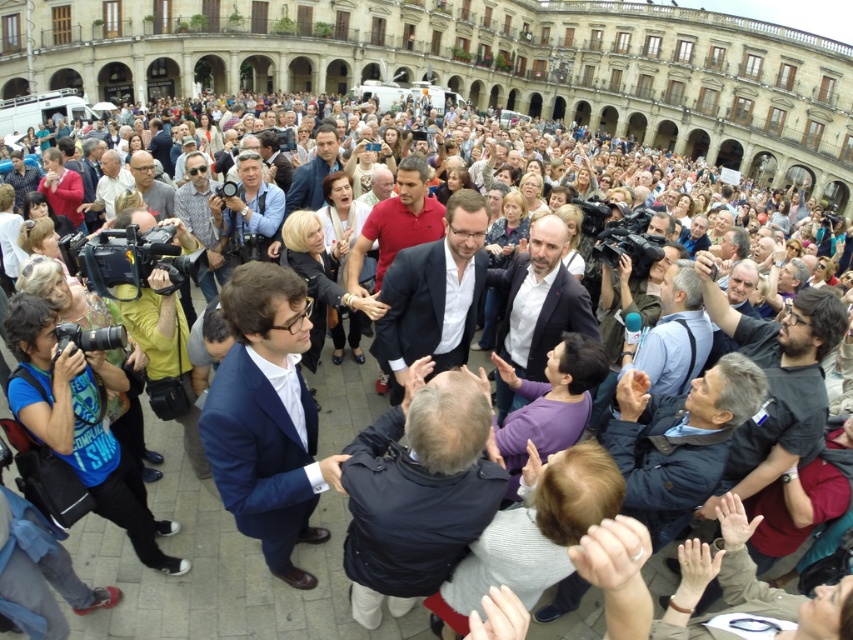
Can you confirm if dark gray shirt at lower right is smaller than matte gray suit at center?

Actually, dark gray shirt at lower right might be larger than matte gray suit at center.

Does dark gray shirt at lower right have a larger size compared to matte gray suit at center?

Correct, dark gray shirt at lower right is larger in size than matte gray suit at center.

Where is `dark gray shirt at lower right`? Image resolution: width=853 pixels, height=640 pixels. dark gray shirt at lower right is located at coordinates (775, 384).

Does matte black suit at center lie in front of light brown leather jacket at center?

No.

Which is behind, point (315, 198) or point (106, 218)?

Point (315, 198)

Where is `matte black suit at center`? This screenshot has height=640, width=853. matte black suit at center is located at coordinates (312, 172).

Who is lower down, matte blue shirt at center or matte black suit at center?

matte blue shirt at center

Can you confirm if matte blue shirt at center is positioned below matte black suit at center?

Yes.

Locate an element on the screen. matte blue shirt at center is located at coordinates (248, 211).

Find the location of a particular element. The width and height of the screenshot is (853, 640). matte blue shirt at center is located at coordinates (248, 211).